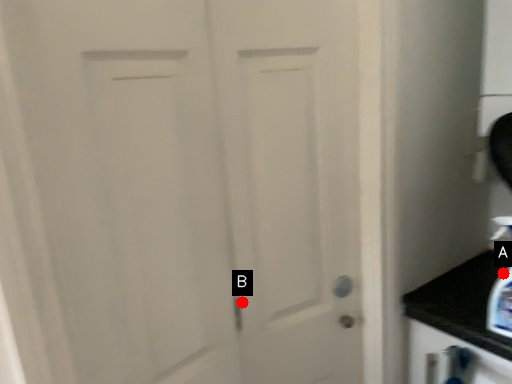
Question: Two points are circled on the image, labeled by A and B beside each circle. Which of the following is the farthest from the observer?

Choices:
 (A) A is further
 (B) B is further

Answer: (A)